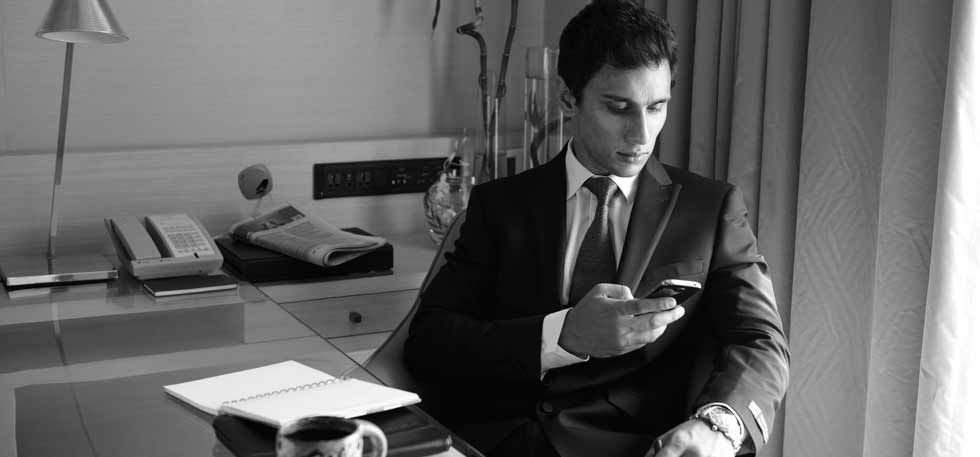
Where is `telephone`? The height and width of the screenshot is (457, 980). telephone is located at coordinates (185, 242).